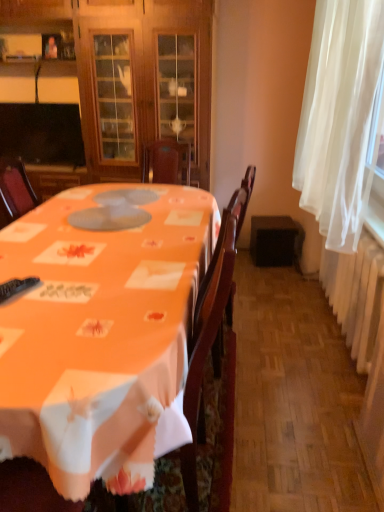
Question: Can you confirm if black plastic remote control at lower left is taller than wooden cabinet at center?

Choices:
 (A) no
 (B) yes

Answer: (A)

Question: Can you confirm if black plastic remote control at lower left is bigger than wooden cabinet at center?

Choices:
 (A) yes
 (B) no

Answer: (B)

Question: From a real-world perspective, is black plastic remote control at lower left positioned under wooden cabinet at center based on gravity?

Choices:
 (A) no
 (B) yes

Answer: (B)

Question: Considering the relative sizes of black plastic remote control at lower left and wooden cabinet at center in the image provided, is black plastic remote control at lower left smaller than wooden cabinet at center?

Choices:
 (A) yes
 (B) no

Answer: (A)

Question: Are black plastic remote control at lower left and wooden cabinet at center far apart?

Choices:
 (A) yes
 (B) no

Answer: (A)

Question: Considering the relative sizes of black plastic remote control at lower left and wooden cabinet at center in the image provided, is black plastic remote control at lower left wider than wooden cabinet at center?

Choices:
 (A) no
 (B) yes

Answer: (A)

Question: Would you say white sheer curtain at right is part of black plastic remote control at lower left's contents?

Choices:
 (A) yes
 (B) no

Answer: (B)

Question: From the image's perspective, does black plastic remote control at lower left appear lower than white sheer curtain at right?

Choices:
 (A) no
 (B) yes

Answer: (B)

Question: Is white sheer curtain at right at the back of black plastic remote control at lower left?

Choices:
 (A) yes
 (B) no

Answer: (B)

Question: Is black plastic remote control at lower left taller than white sheer curtain at right?

Choices:
 (A) no
 (B) yes

Answer: (A)

Question: From a real-world perspective, is black plastic remote control at lower left on top of white sheer curtain at right?

Choices:
 (A) no
 (B) yes

Answer: (A)

Question: Is black plastic remote control at lower left shorter than white sheer curtain at right?

Choices:
 (A) yes
 (B) no

Answer: (A)

Question: Is black plastic remote control at lower left smaller than orange fabric table at center?

Choices:
 (A) yes
 (B) no

Answer: (A)